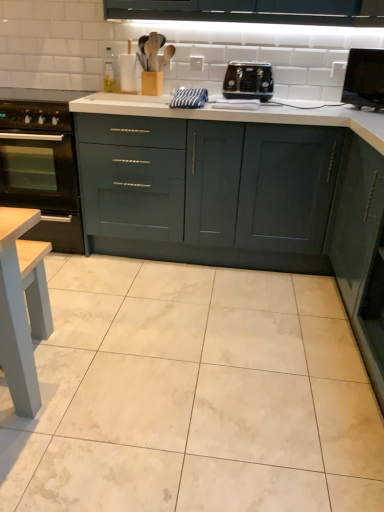
Question: Is black matte gas stove at left inside or outside of black glossy monitor at upper right?

Choices:
 (A) outside
 (B) inside

Answer: (A)

Question: Looking at the image, does black matte gas stove at left seem bigger or smaller compared to black glossy monitor at upper right?

Choices:
 (A) big
 (B) small

Answer: (A)

Question: Estimate the real-world distances between objects in this image. Which object is closer to the black glass oven at lower left?

Choices:
 (A) matte dark green cabinet at right, the second cabinetry in the left-to-right sequence
 (B) black matte gas stove at left
 (C) white glossy tile at center
 (D) teal matte cabinet at center, the 1th cabinetry positioned from the left
 (E) black glossy monitor at upper right

Answer: (B)

Question: Based on their relative distances, which object is nearer to the black matte gas stove at left?

Choices:
 (A) matte dark green cabinet at right, marked as the first cabinetry in a front-to-back arrangement
 (B) black glossy monitor at upper right
 (C) teal matte cabinet at center, which is the first cabinetry in back-to-front order
 (D) black plastic toaster at upper center
 (E) white glossy tile at center

Answer: (C)